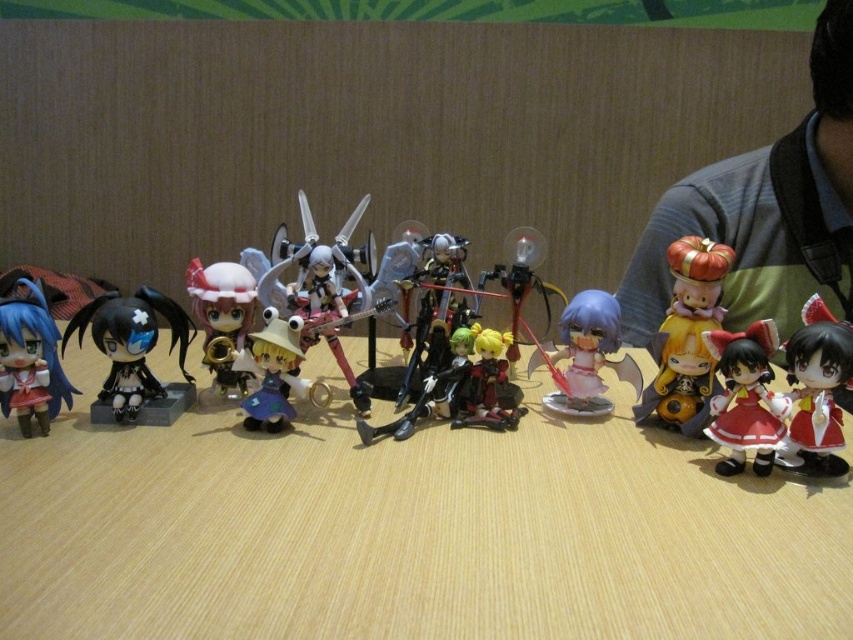
Consider the image. Who is higher up, matte yellow figure at right or shiny black figure at center?

Positioned higher is matte yellow figure at right.

Can you confirm if matte yellow figure at right is smaller than shiny black figure at center?

Actually, matte yellow figure at right might be larger than shiny black figure at center.

Which is in front, point (653, 404) or point (474, 424)?

Point (474, 424) is more forward.

Find the location of a particular element. The height and width of the screenshot is (640, 853). matte yellow figure at right is located at coordinates (688, 336).

Who is taller, matte plastic figurines at center or red glossy doll at lower right?

matte plastic figurines at center

Which is behind, point (38, 308) or point (813, 308)?

The point (38, 308) is behind.

You are a GUI agent. You are given a task and a screenshot of the screen. Output one action in this format:
    pyautogui.click(x=<x>, y=<y>)
    Task: Click on the matte plastic figurines at center
    The image size is (853, 640).
    Given the screenshot: What is the action you would take?
    pyautogui.click(x=51, y=317)

Does point (32, 385) come closer to viewer compared to point (524, 300)?

Yes, point (32, 385) is in front of point (524, 300).

Does point (38, 376) come farther from viewer compared to point (531, 244)?

No, (38, 376) is closer to viewer.

Is point (61, 364) more distant than point (532, 266)?

No, it is not.

Locate an element on the screen. matte blue hair at left is located at coordinates (30, 360).